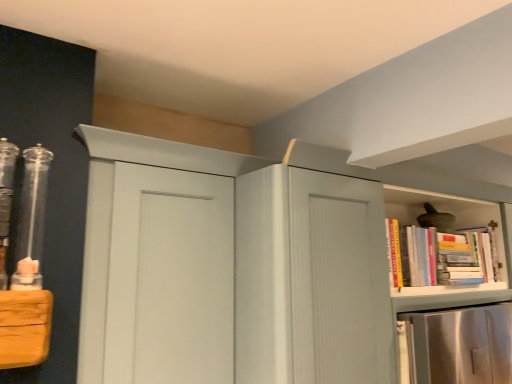
Question: From the image's perspective, is hardcover books at right located above or below matte white cupboard at center?

Choices:
 (A) above
 (B) below

Answer: (A)

Question: Considering the positions of hardcover books at right and matte white cupboard at center in the image, is hardcover books at right wider or thinner than matte white cupboard at center?

Choices:
 (A) thin
 (B) wide

Answer: (A)

Question: Considering their positions, is hardcover books at right located in front of or behind matte white cupboard at center?

Choices:
 (A) behind
 (B) front

Answer: (A)

Question: Is point (203, 327) positioned closer to the camera than point (429, 263)?

Choices:
 (A) farther
 (B) closer

Answer: (B)

Question: Considering the positions of matte white cupboard at center and hardcover books at right in the image, is matte white cupboard at center bigger or smaller than hardcover books at right?

Choices:
 (A) big
 (B) small

Answer: (A)

Question: Considering the relative positions of matte white cupboard at center and hardcover books at right in the image provided, is matte white cupboard at center to the left or to the right of hardcover books at right?

Choices:
 (A) left
 (B) right

Answer: (A)

Question: From their relative heights in the image, would you say matte white cupboard at center is taller or shorter than hardcover books at right?

Choices:
 (A) short
 (B) tall

Answer: (B)